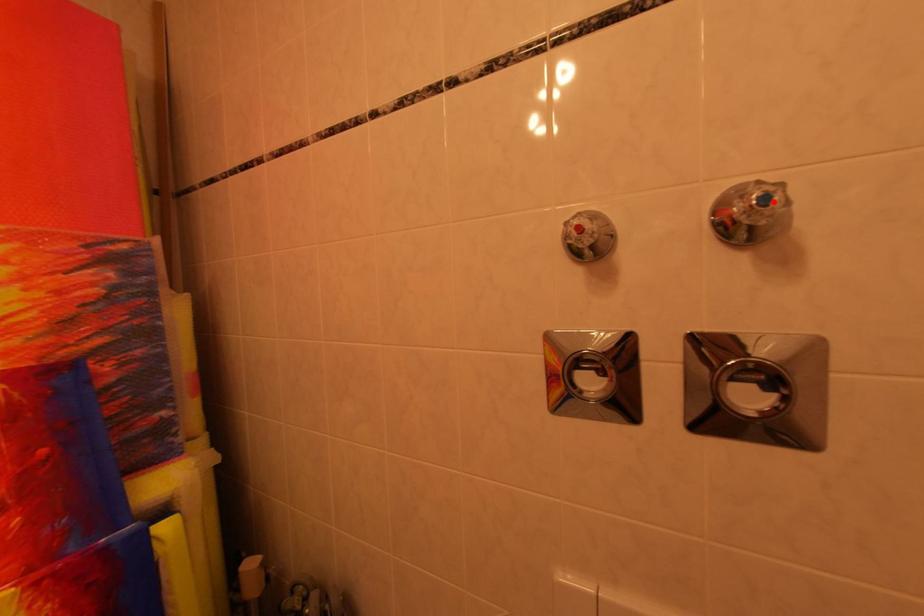
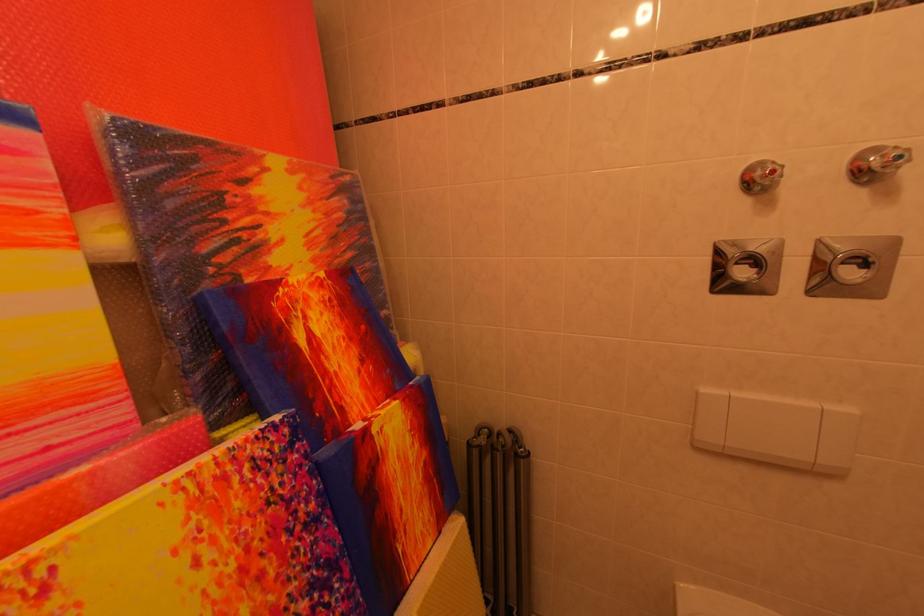
Question: I am providing you with two images of the same scene from different viewpoints. A red point is shown in image1. For the corresponding object point in image2, is it positioned nearer or farther from the camera?

Choices:
 (A) Nearer
 (B) Farther

Answer: (B)